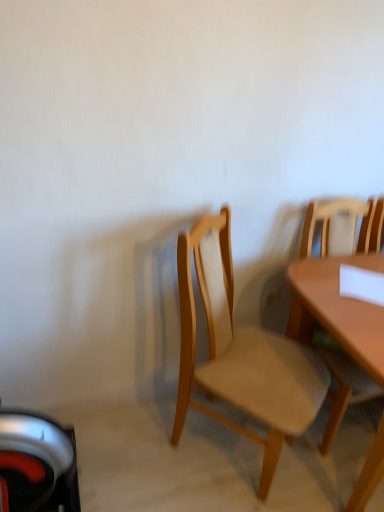
Question: Is light brown wood chair at center, marked as the 2th chair in a right-to-left arrangement, at the back of light brown wood chair at right, positioned as the 2th chair in left-to-right order?

Choices:
 (A) yes
 (B) no

Answer: (B)

Question: Can you confirm if light brown wood chair at right, positioned as the 2th chair in left-to-right order, is thinner than light brown wood chair at center, marked as the 2th chair in a right-to-left arrangement?

Choices:
 (A) no
 (B) yes

Answer: (B)

Question: Is light brown wood chair at right, positioned as the 2th chair in left-to-right order, aimed at light brown wood chair at center, arranged as the 1th chair when viewed from the left?

Choices:
 (A) yes
 (B) no

Answer: (B)

Question: Is the position of light brown wood chair at right, positioned as the 2th chair in left-to-right order, less distant than that of light brown wood chair at center, marked as the 2th chair in a right-to-left arrangement?

Choices:
 (A) no
 (B) yes

Answer: (A)

Question: Is light brown wood chair at right, positioned as the 2th chair in left-to-right order, positioned beyond the bounds of light brown wood chair at center, arranged as the 1th chair when viewed from the left?

Choices:
 (A) no
 (B) yes

Answer: (B)

Question: Are light brown wood chair at right, positioned as the 2th chair in left-to-right order, and light brown wood chair at center, arranged as the 1th chair when viewed from the left, far apart?

Choices:
 (A) no
 (B) yes

Answer: (A)

Question: Is light brown wood chair at center, arranged as the 1th chair when viewed from the left, beside light brown wood chair at right, marked as the 1th chair in a right-to-left arrangement?

Choices:
 (A) no
 (B) yes

Answer: (A)

Question: Is light brown wood chair at center, marked as the 2th chair in a right-to-left arrangement, shorter than light brown wood chair at right, positioned as the 2th chair in left-to-right order?

Choices:
 (A) no
 (B) yes

Answer: (A)

Question: From a real-world perspective, is light brown wood chair at center, marked as the 2th chair in a right-to-left arrangement, over light brown wood chair at right, positioned as the 2th chair in left-to-right order?

Choices:
 (A) yes
 (B) no

Answer: (B)

Question: Is light brown wood chair at center, arranged as the 1th chair when viewed from the left, wider than light brown wood chair at right, positioned as the 2th chair in left-to-right order?

Choices:
 (A) yes
 (B) no

Answer: (A)

Question: Is light brown wood chair at center, arranged as the 1th chair when viewed from the left, behind light brown wood chair at right, positioned as the 2th chair in left-to-right order?

Choices:
 (A) yes
 (B) no

Answer: (B)

Question: Can you confirm if light brown wood chair at center, marked as the 2th chair in a right-to-left arrangement, is smaller than light brown wood chair at right, marked as the 1th chair in a right-to-left arrangement?

Choices:
 (A) yes
 (B) no

Answer: (B)

Question: In the image, is light brown wood chair at right, positioned as the 2th chair in left-to-right order, on the left side or the right side of light brown wood chair at center, arranged as the 1th chair when viewed from the left?

Choices:
 (A) right
 (B) left

Answer: (A)